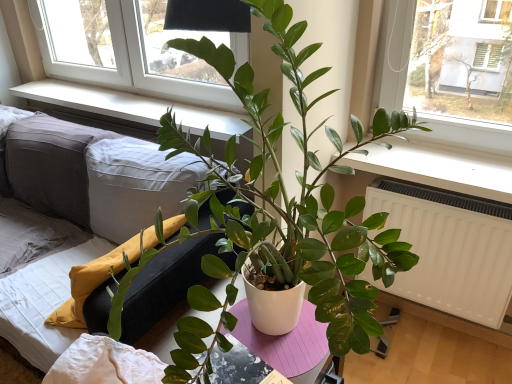
Question: Is white smooth window sill at upper center positioned in front of white matte pot at center?

Choices:
 (A) no
 (B) yes

Answer: (A)

Question: Does white smooth window sill at upper center come behind white matte pot at center?

Choices:
 (A) yes
 (B) no

Answer: (A)

Question: Is white smooth window sill at upper center bigger than white matte pot at center?

Choices:
 (A) yes
 (B) no

Answer: (B)

Question: Does white smooth window sill at upper center have a greater height compared to white matte pot at center?

Choices:
 (A) yes
 (B) no

Answer: (B)

Question: From a real-world perspective, is white smooth window sill at upper center on white matte pot at center?

Choices:
 (A) yes
 (B) no

Answer: (B)

Question: In the image, is white matte radiator at lower right positioned in front of or behind gray fabric couch at center?

Choices:
 (A) behind
 (B) front

Answer: (A)

Question: Is white matte radiator at lower right to the left or to the right of gray fabric couch at center in the image?

Choices:
 (A) left
 (B) right

Answer: (B)

Question: Does point (445, 241) appear closer or farther from the camera than point (140, 329)?

Choices:
 (A) farther
 (B) closer

Answer: (A)

Question: From a real-world perspective, relative to gray fabric couch at center, is white matte radiator at lower right vertically above or below?

Choices:
 (A) above
 (B) below

Answer: (A)

Question: Choose the correct answer: Is white matte pot at center inside white matte radiator at lower right or outside it?

Choices:
 (A) inside
 (B) outside

Answer: (B)

Question: Is white matte pot at center to the left or to the right of white matte radiator at lower right in the image?

Choices:
 (A) left
 (B) right

Answer: (A)

Question: Is white matte pot at center taller or shorter than white matte radiator at lower right?

Choices:
 (A) short
 (B) tall

Answer: (B)

Question: Considering the positions of point (353, 299) and point (424, 200), is point (353, 299) closer or farther from the camera than point (424, 200)?

Choices:
 (A) farther
 (B) closer

Answer: (B)

Question: Considering the positions of white smooth window sill at upper center and gray fabric couch at center in the image, is white smooth window sill at upper center wider or thinner than gray fabric couch at center?

Choices:
 (A) thin
 (B) wide

Answer: (A)

Question: Is white smooth window sill at upper center bigger or smaller than gray fabric couch at center?

Choices:
 (A) big
 (B) small

Answer: (B)